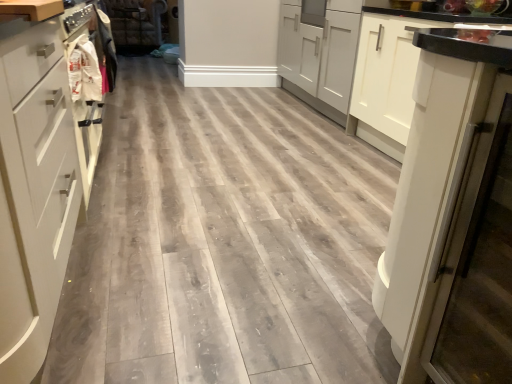
Question: In the image, is white matte cabinet at right, marked as the first cabinetry in a right-to-left arrangement, positioned in front of or behind white matte drawer at left?

Choices:
 (A) behind
 (B) front

Answer: (A)

Question: In the image, is white matte cabinet at right, which is the first cabinetry from back to front, on the left side or the right side of white matte drawer at left?

Choices:
 (A) right
 (B) left

Answer: (A)

Question: Which object is the closest to the white fabric bag at left?

Choices:
 (A) white matte drawer at left
 (B) white fabric laundry at left
 (C) faux leather couch at upper center
 (D) white matte cabinet at left, which is counted as the first cabinetry, starting from the left
 (E) white matte cabinet at right, which is the first cabinetry from back to front

Answer: (A)

Question: Estimate the real-world distances between objects in this image. Which object is closer to the white matte drawer at left?

Choices:
 (A) white matte cabinet at right, arranged as the 2th cabinetry when viewed from the front
 (B) faux leather couch at upper center
 (C) white glossy refrigerator at right
 (D) white matte cabinet at left, the first cabinetry viewed from the front
 (E) white fabric bag at left

Answer: (D)